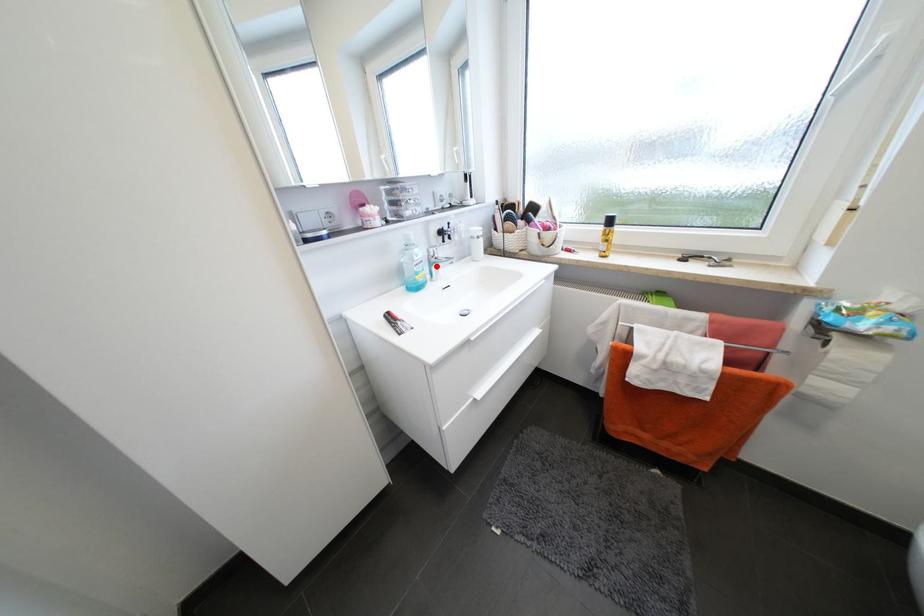
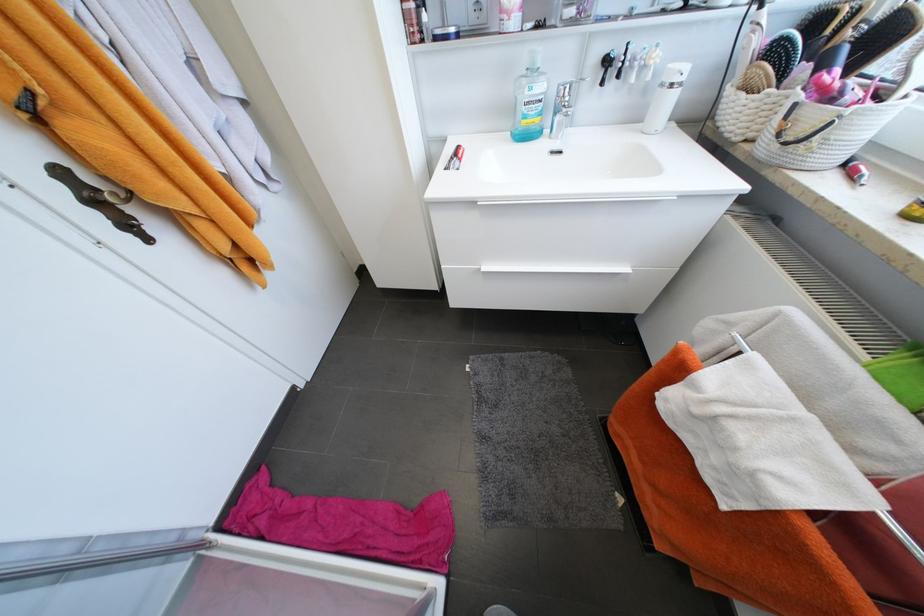
The point at the highlighted location is marked in the first image. Where is the corresponding point in the second image?

(562, 113)